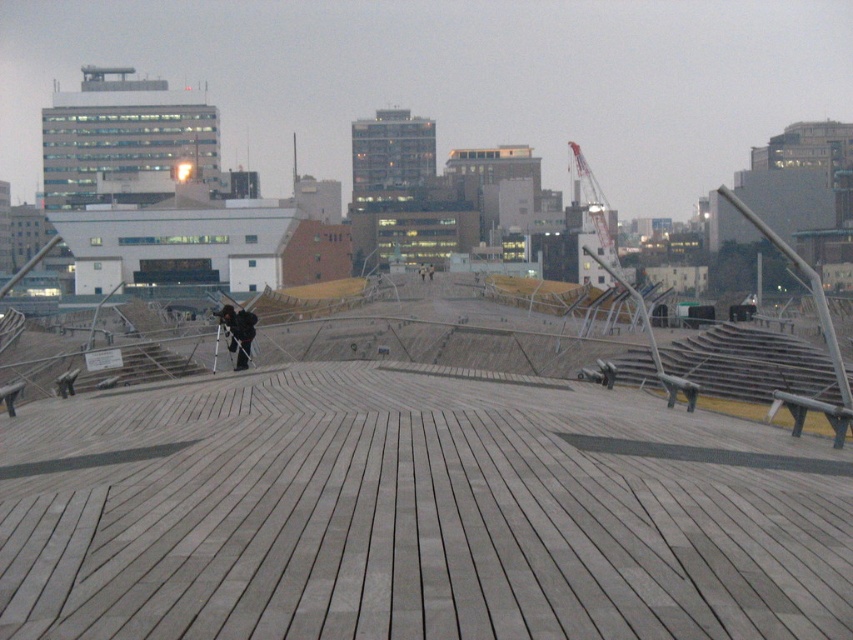
In the scene shown: You are standing on the curved wooden deck and see the black matte jacket at center. If you want to walk directly towards the jacket, which direction should you move relative to the deck?

The black matte jacket at center is located at point (238,332). Since the deck curves gently towards the center of the frame where it meets the yellow tiled area, you should move towards the center of the deck to walk directly towards the jacket.